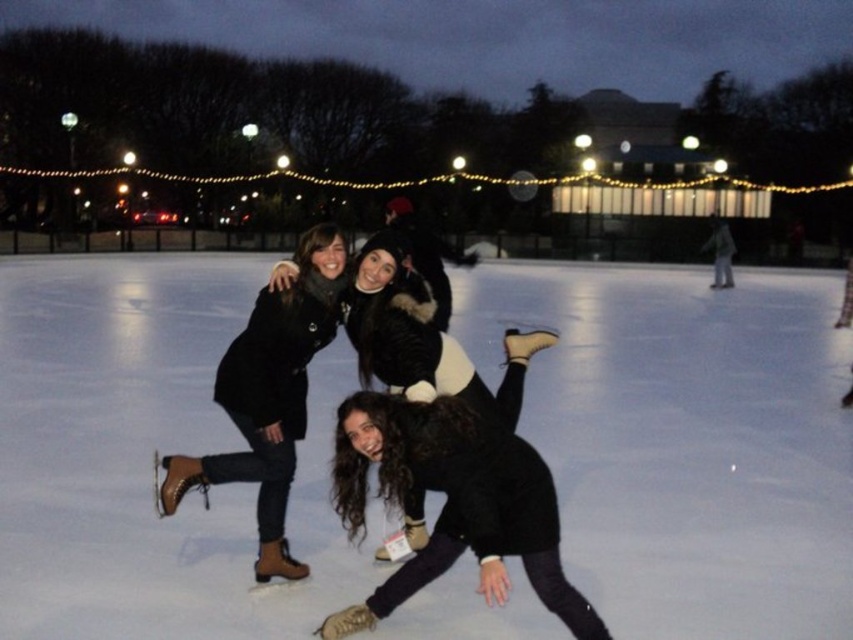
You are standing at the entrance of the ice skating rink and want to locate the white ice skating rink at center. According to the coordinates provided, where should you look?

The white ice skating rink at center is located at coordinates point (685, 440).

You are planning to place a small decorative snowman on the ice. Given the sizes of the white ice skating rink at center and the matte brown boots at center, where should you place the snowman so it won t be stepped on by the boots?

Since the white ice skating rink at center is larger than the matte brown boots at center, you should place the snowman on the white ice skating rink at center away from the matte brown boots at center to avoid it being stepped on.

You are standing at the edge of the ice skating rink and want to move towards the two points marked in the image. Which point, point (459, 548) or point (287, 486), will you reach first?

Point (459, 548) is closer to the viewer than point (287, 486), so you will reach point (459, 548) first.